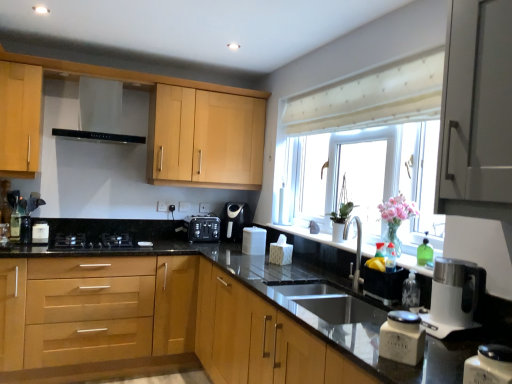
What is the approximate height of translucent glass bottle at left, marked as the first bottle in a back-to-front arrangement?

The height of translucent glass bottle at left, marked as the first bottle in a back-to-front arrangement, is 10.61 inches.

The width and height of the screenshot is (512, 384). What are the coordinates of `black matte gas stove at lower left` in the screenshot? It's located at (97, 241).

Where is `white plastic kettle at right`? white plastic kettle at right is located at coordinates (453, 296).

What do you see at coordinates (254, 241) in the screenshot? I see `white plastic container at center, which is counted as the 2th appliance, starting from the left` at bounding box center [254, 241].

Describe the element at coordinates (477, 112) in the screenshot. The height and width of the screenshot is (384, 512). I see `satin grey cabinet at upper right, placed as the 2th cabinetry when sorted from bottom to top` at that location.

Locate an element on the screen. The height and width of the screenshot is (384, 512). satin grey cabinet at upper right, the second cabinetry from the top is located at coordinates (477, 112).

Where is `translucent glass bottle at left, marked as the first bottle in a back-to-front arrangement`? The image size is (512, 384). translucent glass bottle at left, marked as the first bottle in a back-to-front arrangement is located at coordinates coord(16,215).

From a real-world perspective, who is located higher, white plastic kettle at right or black matte gas stove at lower left?

From a 3D spatial view, white plastic kettle at right is above.

I want to click on gas stove below the white plastic kettle at right (from a real-world perspective), so click(x=97, y=241).

From the picture: Which object is thinner, white plastic kettle at right or black matte gas stove at lower left?

white plastic kettle at right is thinner.

Looking at the image, does white plastic kettle at right seem bigger or smaller compared to black matte gas stove at lower left?

Considering their sizes, white plastic kettle at right takes up less space than black matte gas stove at lower left.

I want to click on the 2nd cabinetry counting from the left side of the white matte coffee container at lower right, placed as the 2th kitchen appliance when sorted from front to back, so click(x=127, y=75).

From a real-world perspective, is white matte coffee container at lower right, the first kitchen appliance from the back, physically located above or below light wood/finish cabinet at upper left, the 3th cabinetry positioned from the bottom?

From a real-world perspective, white matte coffee container at lower right, the first kitchen appliance from the back, is physically below light wood/finish cabinet at upper left, the 3th cabinetry positioned from the bottom.

Which is more to the right, white matte coffee container at lower right, the 1th kitchen appliance in the left-to-right sequence, or light wood/finish cabinet at upper left, positioned as the first cabinetry in top-to-bottom order?

white matte coffee container at lower right, the 1th kitchen appliance in the left-to-right sequence, is more to the right.

Is white matte coffee container at lower right, placed as the 2th kitchen appliance when sorted from front to back, behind light wood/finish cabinet at upper left, positioned as the first cabinetry in top-to-bottom order?

No, white matte coffee container at lower right, placed as the 2th kitchen appliance when sorted from front to back, is closer to the camera.

Is satin grey cabinet at upper right, placed as the 2th cabinetry when sorted from bottom to top, to the left or to the right of white plastic container at center, which is counted as the 2th appliance, starting from the left, in the image?

In the image, satin grey cabinet at upper right, placed as the 2th cabinetry when sorted from bottom to top, appears on the right side of white plastic container at center, which is counted as the 2th appliance, starting from the left.

Consider the image. Does satin grey cabinet at upper right, the second cabinetry from the top, touch white plastic container at center, which is counted as the 2th appliance, starting from the left?

No, satin grey cabinet at upper right, the second cabinetry from the top, is not next to white plastic container at center, which is counted as the 2th appliance, starting from the left.

Could you measure the distance between satin grey cabinet at upper right, placed as the 2th cabinetry when sorted from bottom to top, and white plastic container at center, which ranks as the 1th appliance in right-to-left order?

They are 6.13 feet apart.

Can you confirm if satin grey cabinet at upper right, placed as the 2th cabinetry when sorted from bottom to top, is shorter than white plastic container at center, which ranks as the 1th appliance in right-to-left order?

No.

From the image's perspective, is white matte coffee container at lower right, placed as the 2th kitchen appliance when sorted from front to back, under satin grey cabinet at upper right, the second cabinetry from the top?

Yes.

Could you tell me if white matte coffee container at lower right, the 1th kitchen appliance in the left-to-right sequence, is facing satin grey cabinet at upper right, the second cabinetry from the top?

No, white matte coffee container at lower right, the 1th kitchen appliance in the left-to-right sequence, does not turn towards satin grey cabinet at upper right, the second cabinetry from the top.

This screenshot has width=512, height=384. In order to click on kitchen appliance that is the 1st object located below the satin grey cabinet at upper right, the second cabinetry from the top (from the image's perspective) in this screenshot , I will do `click(402, 338)`.

Can you confirm if white plastic kettle at right is shorter than translucent glass bottle at left, placed as the 2th bottle when sorted from bottom to top?

In fact, white plastic kettle at right may be taller than translucent glass bottle at left, placed as the 2th bottle when sorted from bottom to top.

Is white plastic kettle at right wider or thinner than translucent glass bottle at left, the 2th bottle in the front-to-back sequence?

Considering their sizes, white plastic kettle at right looks broader than translucent glass bottle at left, the 2th bottle in the front-to-back sequence.

Measure the distance between white plastic kettle at right and translucent glass bottle at left, placed as the 2th bottle when sorted from bottom to top.

The distance of white plastic kettle at right from translucent glass bottle at left, placed as the 2th bottle when sorted from bottom to top, is 9.24 feet.

Could you tell me if white plastic kettle at right is turned towards translucent glass bottle at left, which is the 2th bottle in right-to-left order?

No.

From a real-world perspective, is light wood/finish cabinet at upper left, positioned as the first cabinetry in top-to-bottom order, under light wood cabinet at center, the 1th cabinetry when ordered from bottom to top?

Incorrect, from a real-world perspective, light wood/finish cabinet at upper left, positioned as the first cabinetry in top-to-bottom order, is higher than light wood cabinet at center, the 1th cabinetry when ordered from bottom to top.

Where is `the 2nd cabinetry in front when counting from the light wood/finish cabinet at upper left, the 3th cabinetry positioned from the bottom`? This screenshot has width=512, height=384. the 2nd cabinetry in front when counting from the light wood/finish cabinet at upper left, the 3th cabinetry positioned from the bottom is located at coordinates (167, 323).

From the picture: Is light wood/finish cabinet at upper left, positioned as the first cabinetry in top-to-bottom order, beside light wood cabinet at center, the 1th cabinetry when ordered from bottom to top?

No, light wood/finish cabinet at upper left, positioned as the first cabinetry in top-to-bottom order, is not beside light wood cabinet at center, the 1th cabinetry when ordered from bottom to top.

Does satin grey cabinet at upper right, the second cabinetry from the top, come behind satin black coffee machine at center?

No, it is in front of satin black coffee machine at center.

From a real-world perspective, is satin grey cabinet at upper right, placed as the 2th cabinetry when sorted from bottom to top, over satin black coffee machine at center?

Yes, from a real-world perspective, satin grey cabinet at upper right, placed as the 2th cabinetry when sorted from bottom to top, is on top of satin black coffee machine at center.

Looking at this image, is satin black coffee machine at center at the back of satin grey cabinet at upper right, placed as the 2th cabinetry when sorted from bottom to top?

No.

Looking at this image, in terms of size, does satin grey cabinet at upper right, the second cabinetry from the top, appear bigger or smaller than satin black coffee machine at center?

Considering their sizes, satin grey cabinet at upper right, the second cabinetry from the top, takes up more space than satin black coffee machine at center.

This screenshot has width=512, height=384. In order to click on gas stove that appears on the left of white plastic kettle at right in this screenshot , I will do `click(97, 241)`.

From the image's perspective, count 1st kitchen appliances downward from the light wood/finish cabinet at upper left, positioned as the first cabinetry in top-to-bottom order, and point to it. Please provide its 2D coordinates.

[(402, 338)]

Estimate the real-world distances between objects in this image. Which object is further from white plastic container at center, which ranks as the 1th appliance in right-to-left order, white matte coffee container at lower right, the first kitchen appliance from the back, or satin black toaster at center, the first appliance when ordered from left to right?

white matte coffee container at lower right, the first kitchen appliance from the back, is further to white plastic container at center, which ranks as the 1th appliance in right-to-left order.

Based on their spatial positions, is satin black toaster at center, which ranks as the second appliance in right-to-left order, or white plastic container at center, arranged as the 1th appliance when viewed from the front, further from black matte exhaust hood at upper center?

white plastic container at center, arranged as the 1th appliance when viewed from the front, lies further to black matte exhaust hood at upper center than the other object.

Estimate the real-world distances between objects in this image. Which object is further from satin black coffee machine at center, light wood/finish cabinet at upper left, the 3th cabinetry positioned from the bottom, or white glossy container at lower right, marked as the 1th kitchen appliance in a front-to-back arrangement?

Among the two, white glossy container at lower right, marked as the 1th kitchen appliance in a front-to-back arrangement, is located further to satin black coffee machine at center.

Based on their spatial positions, is black matte gas stove at lower left or translucent glass bottle at left, which is the 2th bottle in right-to-left order, further from white matte coffee container at lower right, acting as the 2th kitchen appliance starting from the right?

translucent glass bottle at left, which is the 2th bottle in right-to-left order, is positioned further to the anchor white matte coffee container at lower right, acting as the 2th kitchen appliance starting from the right.

Looking at the image, which one is located closer to satin black toaster at center, the first appliance when ordered from left to right, light wood cabinet at center, which is the third cabinetry in top-to-bottom order, or white plastic container at center, arranged as the 1th appliance when viewed from the front?

Based on the image, white plastic container at center, arranged as the 1th appliance when viewed from the front, appears to be nearer to satin black toaster at center, the first appliance when ordered from left to right.

Based on their spatial positions, is white glossy container at lower right, the second kitchen appliance viewed from the left, or white fabric at upper center further from satin black coffee machine at center?

The object further to satin black coffee machine at center is white glossy container at lower right, the second kitchen appliance viewed from the left.

Looking at the image, which one is located closer to light wood/finish cabinet at upper left, the 3th cabinetry positioned from the bottom, light wood cabinet at center, the 1th cabinetry when ordered from bottom to top, or black matte gas stove at lower left?

black matte gas stove at lower left lies closer to light wood/finish cabinet at upper left, the 3th cabinetry positioned from the bottom, than the other object.

Estimate the real-world distances between objects in this image. Which object is closer to satin black toaster at center, which ranks as the 2th appliance in front-to-back order, clear plastic bottle at sink right, which ranks as the first bottle in right-to-left order, or light wood/finish cabinet at upper left, the 3th cabinetry positioned from the bottom?

light wood/finish cabinet at upper left, the 3th cabinetry positioned from the bottom.

Find the location of a particular element. window screen between light wood cabinet at center, which is the third cabinetry in top-to-bottom order, and translucent glass bottle at left, marked as the 1th bottle in a left-to-right arrangement, in the front-back direction is located at coordinates (370, 176).

This screenshot has width=512, height=384. Identify the location of exhaust hood positioned between white plastic kettle at right and satin black toaster at center, which is the first appliance from back to front, from near to far. (100, 113).

The image size is (512, 384). Identify the location of home appliance between white matte coffee container at lower right, the first kitchen appliance from the back, and white fabric at upper center in the front-back direction. (453, 296).

You are a GUI agent. You are given a task and a screenshot of the screen. Output one action in this format:
    pyautogui.click(x=<x>, y=<y>)
    Task: Click on the exhaust hood between translucent glass bottle at left, the 2th bottle in the front-to-back sequence, and white glossy container at lower right, the second kitchen appliance viewed from the left, from left to right
    This screenshot has width=512, height=384.
    Given the screenshot: What is the action you would take?
    pyautogui.click(x=100, y=113)